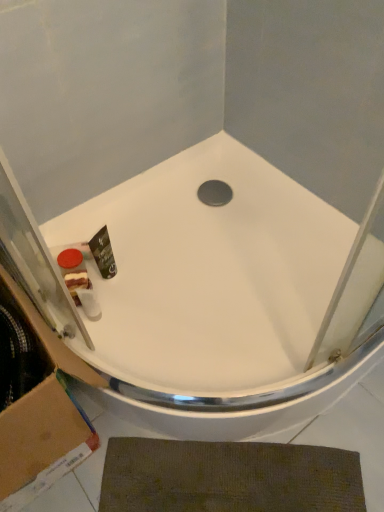
Locate an element on the screen. This screenshot has height=512, width=384. vacant space situated above brown textured bath mat at lower center (from a real-world perspective) is located at coordinates (226, 475).